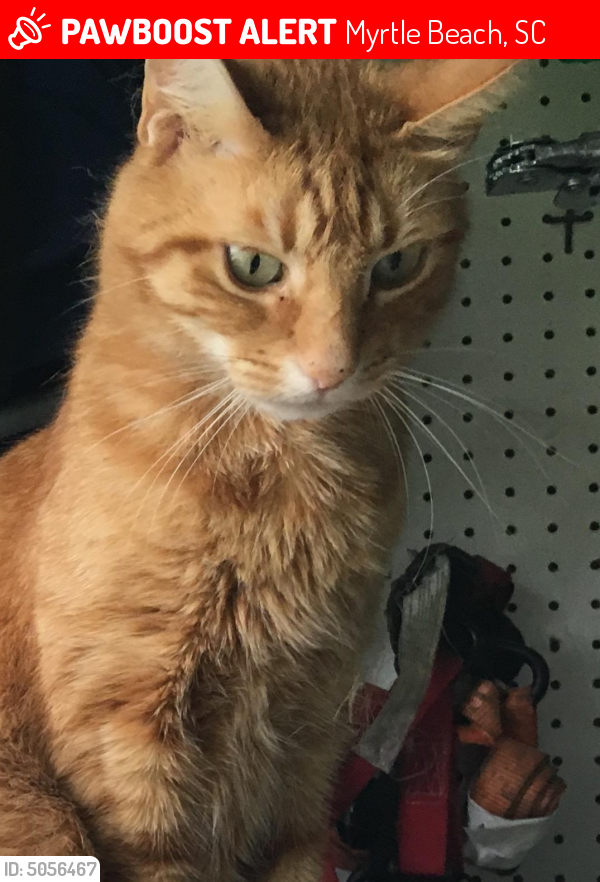
This screenshot has width=600, height=882. Find the location of `pegboard`. pegboard is located at coordinates (539, 446).